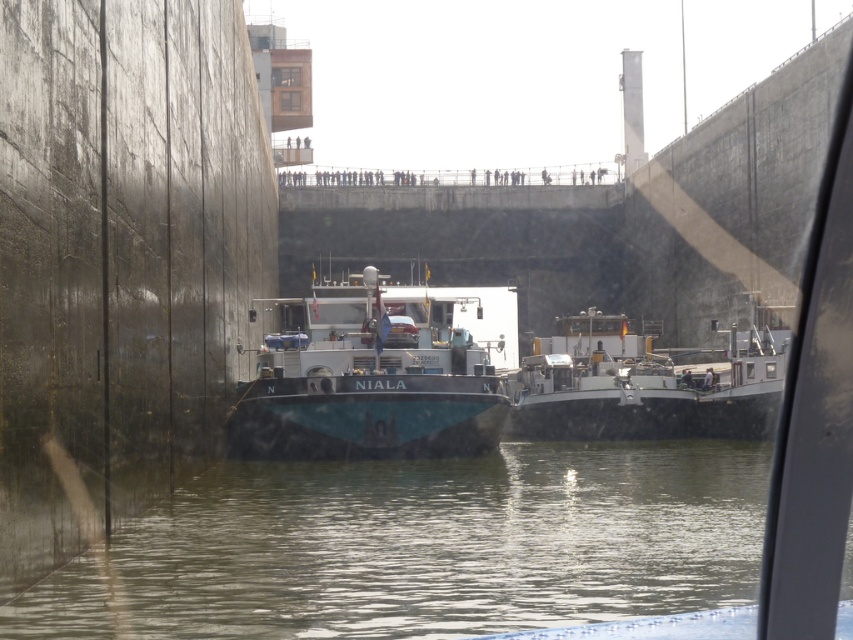
Can you confirm if teal matte boat at center is smaller than white glossy barge at center?

No.

Who is shorter, teal matte boat at center or white glossy barge at center?

white glossy barge at center

Which is in front, point (349, 401) or point (727, 426)?

Point (349, 401) is more forward.

Locate an element on the screen. This screenshot has height=640, width=853. teal matte boat at center is located at coordinates (370, 378).

Which is behind, point (184, 560) or point (753, 326)?

Positioned behind is point (753, 326).

Between clear water at center and white glossy barge at center, which one appears on the right side from the viewer's perspective?

white glossy barge at center is more to the right.

The height and width of the screenshot is (640, 853). Identify the location of clear water at center. (424, 547).

Identify the location of clear water at center. (424, 547).

Who is shorter, clear water at center or teal matte boat at center?

Standing shorter between the two is clear water at center.

Does clear water at center have a larger size compared to teal matte boat at center?

Incorrect, clear water at center is not larger than teal matte boat at center.

Who is more distant from viewer, [554,595] or [325,406]?

The point [325,406] is behind.

At what (x,y) coordinates should I click in order to perform the action: click on clear water at center. Please return your answer as a coordinate pair (x, y). This screenshot has width=853, height=640. Looking at the image, I should click on (424, 547).